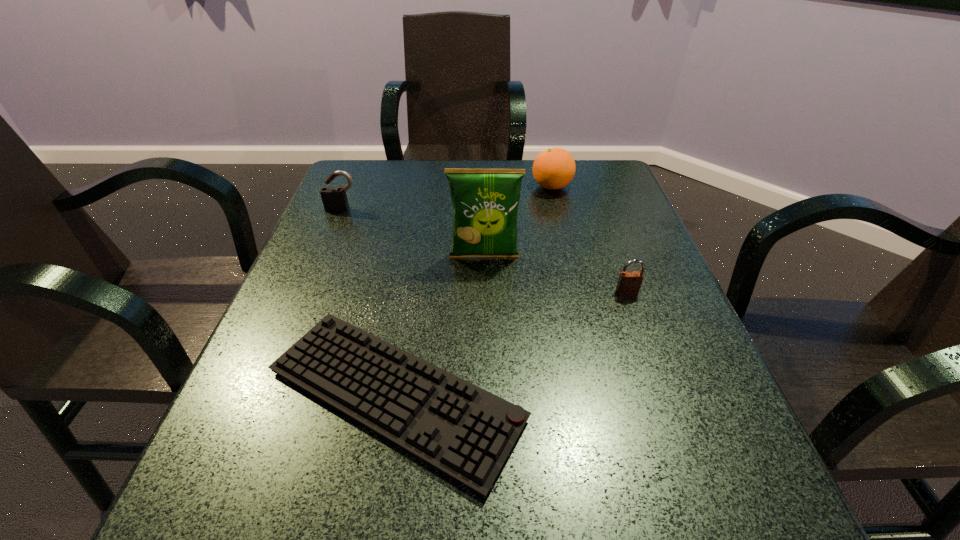
Where is `the tallest object`? The image size is (960, 540). the tallest object is located at coordinates (485, 202).

Image resolution: width=960 pixels, height=540 pixels. Find the location of `crisp (potato chip)`. crisp (potato chip) is located at coordinates (485, 202).

You are a GUI agent. You are given a task and a screenshot of the screen. Output one action in this format:
    pyautogui.click(x=<x>, y=<y>)
    Task: Click on the farthest object
    The image size is (960, 540).
    Given the screenshot: What is the action you would take?
    pyautogui.click(x=554, y=168)

Identify the location of the second object from right to left. The width and height of the screenshot is (960, 540). (554, 168).

Where is `the left padlock`? the left padlock is located at coordinates (334, 199).

Locate an element on the screen. The image size is (960, 540). the farther padlock is located at coordinates (x=334, y=199).

Where is `the shorter padlock`? This screenshot has width=960, height=540. the shorter padlock is located at coordinates [x=629, y=283].

Image resolution: width=960 pixels, height=540 pixels. In order to click on the nearer padlock in this screenshot , I will do `click(629, 283)`.

What are the coordinates of `the nearest object` in the screenshot? It's located at (462, 430).

At what (x,y) coordinates should I click in order to perform the action: click on the shortest object. Please return your answer as a coordinate pair (x, y). Looking at the image, I should click on (462, 430).